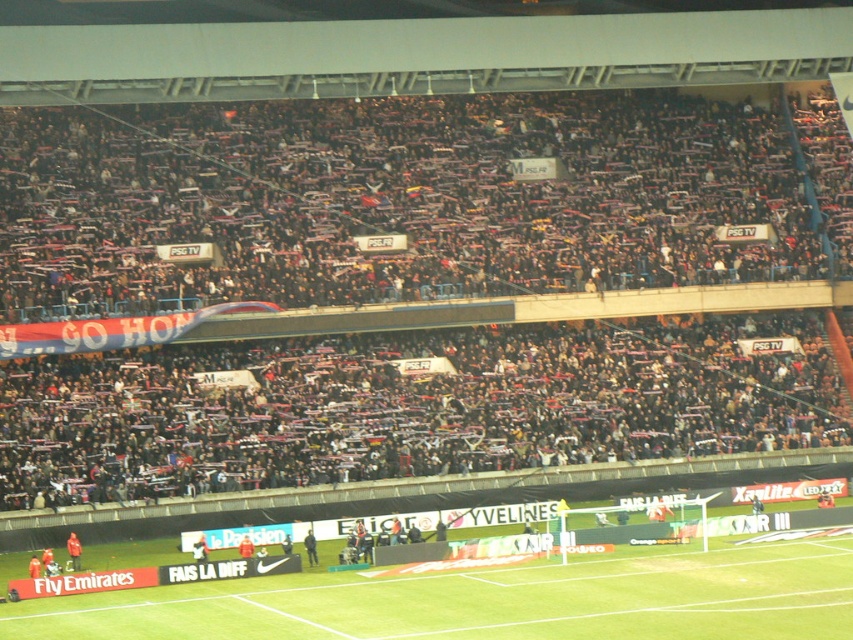
Question: Does green grass football field at lower center appear on the right side of green fabric jacket at lower center?

Choices:
 (A) no
 (B) yes

Answer: (B)

Question: Which object is closer to the camera taking this photo?

Choices:
 (A) green grass football field at lower center
 (B) orange jersey at center

Answer: (A)

Question: Which point is farther from the camera taking this photo?

Choices:
 (A) (74, 564)
 (B) (221, 580)
 (C) (310, 547)

Answer: (C)

Question: Which object is closer to the camera taking this photo?

Choices:
 (A) green fabric jacket at lower center
 (B) dark blue jersey at center
 (C) green grass football field at lower center
 (D) orange jersey at center

Answer: (C)

Question: Does green grass football field at lower center have a lesser width compared to dark blue jersey at center?

Choices:
 (A) no
 (B) yes

Answer: (A)

Question: Does green grass football field at lower center appear under green fabric jacket at lower center?

Choices:
 (A) no
 (B) yes

Answer: (B)